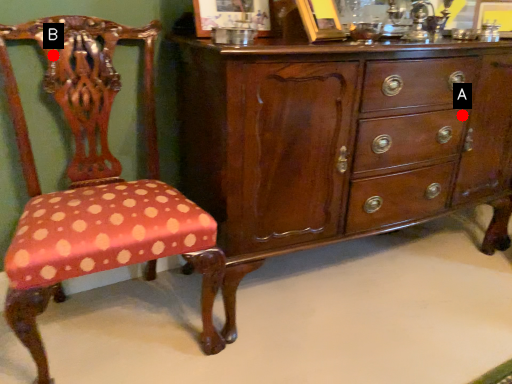
Question: Two points are circled on the image, labeled by A and B beside each circle. Among these points, which one is nearest to the camera?

Choices:
 (A) A is closer
 (B) B is closer

Answer: (B)